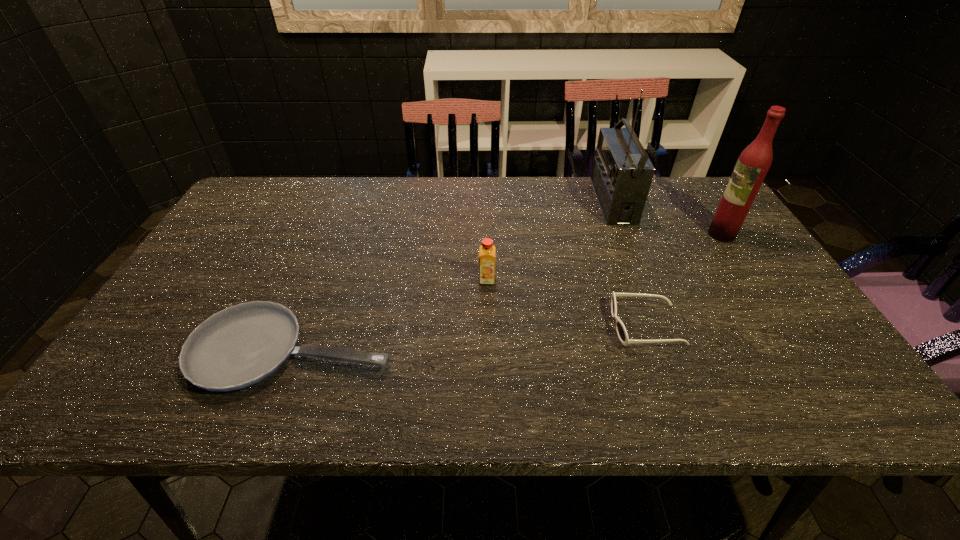
Identify the location of object located at the near edge. (242, 345).

Image resolution: width=960 pixels, height=540 pixels. What are the coordinates of `object present at the left edge` in the screenshot? It's located at (242, 345).

Find the location of `object present at the right edge`. object present at the right edge is located at coordinates pos(755,160).

What are the coordinates of `object that is positioned at the near left corner` in the screenshot? It's located at (x=242, y=345).

In order to click on vacant region at the far edge in this screenshot , I will do `click(366, 201)`.

You are a GUI agent. You are given a task and a screenshot of the screen. Output one action in this format:
    pyautogui.click(x=<x>, y=<y>)
    Task: Click on the free region at the left edge
    Image resolution: width=960 pixels, height=540 pixels.
    Given the screenshot: What is the action you would take?
    pyautogui.click(x=166, y=322)

This screenshot has width=960, height=540. I want to click on vacant space at the right edge of the desktop, so pos(709,261).

The image size is (960, 540). I want to click on free region at the far left corner of the desktop, so click(258, 211).

I want to click on vacant space at the far right corner of the desktop, so click(x=683, y=194).

What are the coordinates of `free space between the sunglasses and the fourth nearest object` in the screenshot? It's located at click(684, 280).